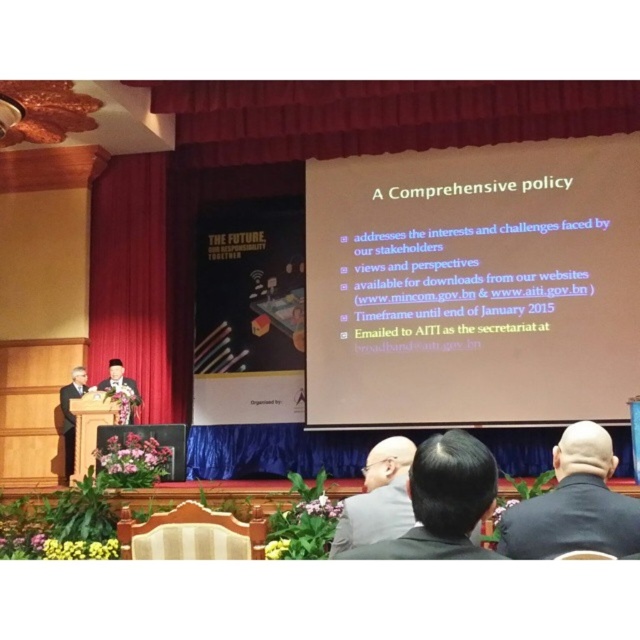
You are standing in the conference hall and want to exit through the nearest emergency exit. The red velvet curtain at left is blocking your view. Where should you move to get a clear view of the emergency exit?

Move to the right side of the red velvet curtain at left to get a clear view of the emergency exit since the curtain is positioned at the left side of the stage.

You are an attendee at the presentation and you need to hand a document to the person in the black suit at center and the person in the matte black suit at left. Which person is closer to the podium?

Both individuals are on the podium. The black suit at center is located above the matte black suit at left, meaning they are positioned higher up on the stage. Since the podium is the central area, the black suit at center is closer to the podium.

You are standing at the back of the conference hall and see two points on the stage. The first point is at position point (444, 500) and the second is at point (392, 532). Which point is closer to you?

Point (392, 532) is further away from you than point (444, 500), so the closer point is point (444, 500).